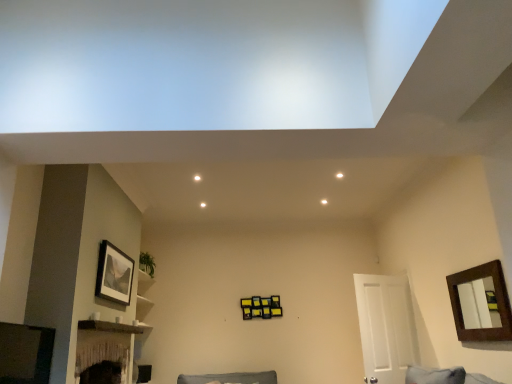
Question: Considering their positions, is brown wooden picture frame at upper right, which is the first picture frame in right-to-left order, located in front of or behind white matte door at right?

Choices:
 (A) front
 (B) behind

Answer: (A)

Question: From a real-world perspective, relative to white matte door at right, is brown wooden picture frame at upper right, which is the first picture frame in right-to-left order, vertically above or below?

Choices:
 (A) below
 (B) above

Answer: (B)

Question: Which object is the closest to the brown wooden picture frame at upper right, the 2th picture frame from the left?

Choices:
 (A) white matte door at right
 (B) matte black picture frame at upper left, the 1th picture frame positioned from the left
 (C) brown wooden shelf at lower left

Answer: (A)

Question: Based on their relative distances, which object is nearer to the brown wooden shelf at lower left?

Choices:
 (A) white matte door at right
 (B) brown wooden picture frame at upper right, the 2th picture frame from the left
 (C) matte black picture frame at upper left, the 1th picture frame positioned from the left

Answer: (C)